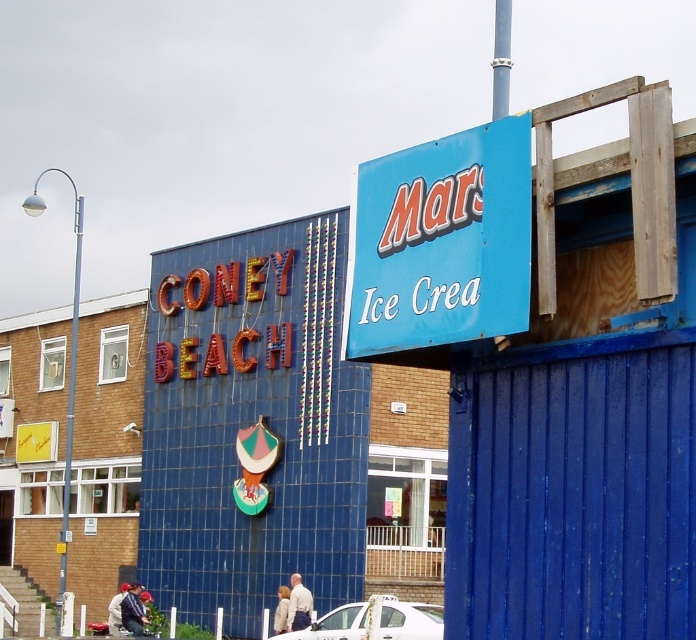
Question: Which object appears closest to the camera in this image?

Choices:
 (A) blue matte sign at upper right
 (B) white glossy car at lower center

Answer: (A)

Question: Does blue matte sign at upper right appear under white glossy car at lower center?

Choices:
 (A) no
 (B) yes

Answer: (A)

Question: Does blue matte sign at upper right have a smaller size compared to white glossy car at lower center?

Choices:
 (A) no
 (B) yes

Answer: (A)

Question: Where is blue matte sign at upper right located in relation to white glossy car at lower center in the image?

Choices:
 (A) right
 (B) left

Answer: (A)

Question: Which object appears farthest from the camera in this image?

Choices:
 (A) blue matte sign at upper right
 (B) white glossy car at lower center

Answer: (B)